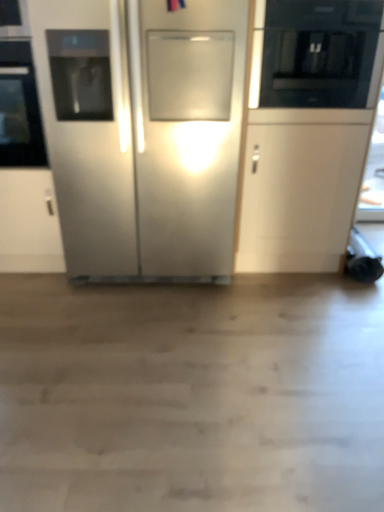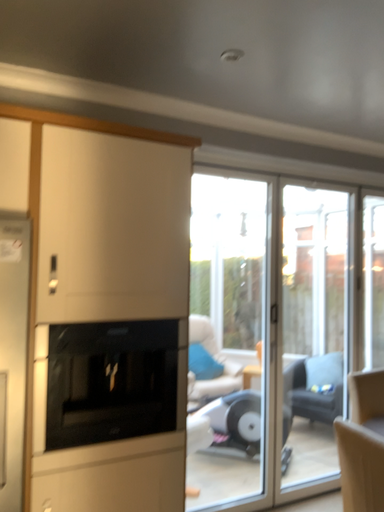
Question: Which way did the camera rotate in the video?

Choices:
 (A) rotated downward
 (B) rotated upward

Answer: (B)